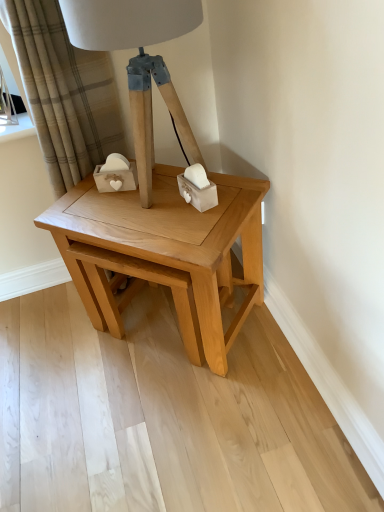
Locate an element on the screen. free space to the left of beige plaid curtain at upper left is located at coordinates (44, 306).